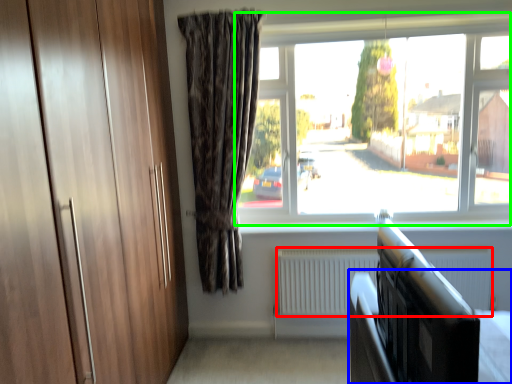
Question: Considering the real-world distances, which object is closest to radiator (highlighted by a red box)? bed frame (highlighted by a blue box) or window (highlighted by a green box).

Choices:
 (A) bed frame
 (B) window

Answer: (B)